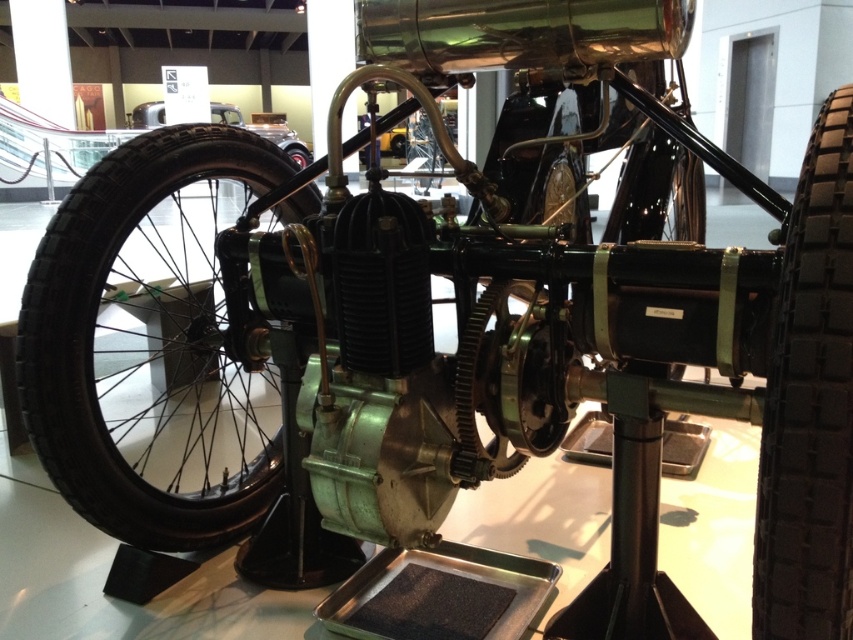
You are a museum guide explaining the vintage car to visitors. You point out the black rubber tire at left and the black rubber tire at right. Which tire is located above the other?

The black rubber tire at left is positioned under the black rubber tire at right, meaning the tire at right is above the one on the left.

You are a tour guide explaining the layout of the museum exhibit. You mention the black rubber tire at left. Where exactly is it located in terms of coordinates?

The black rubber tire at left is located at coordinates 0.539 on the x axis and 0.178 on the y axis.